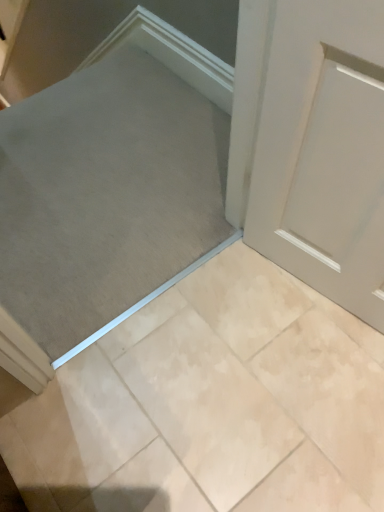
Question: Would you say gray fabric at center is to the left or to the right of beige marble tile at center in the picture?

Choices:
 (A) left
 (B) right

Answer: (A)

Question: In terms of height, does gray fabric at center look taller or shorter compared to beige marble tile at center?

Choices:
 (A) tall
 (B) short

Answer: (B)

Question: Is gray fabric at center wider or thinner than beige marble tile at center?

Choices:
 (A) thin
 (B) wide

Answer: (B)

Question: Considering the positions of beige marble tile at center and gray fabric at center in the image, is beige marble tile at center taller or shorter than gray fabric at center?

Choices:
 (A) tall
 (B) short

Answer: (A)

Question: From the image's perspective, is beige marble tile at center located above or below gray fabric at center?

Choices:
 (A) below
 (B) above

Answer: (A)

Question: Is beige marble tile at center wider or thinner than gray fabric at center?

Choices:
 (A) thin
 (B) wide

Answer: (A)

Question: Is point (279, 429) positioned closer to the camera than point (193, 96)?

Choices:
 (A) closer
 (B) farther

Answer: (A)